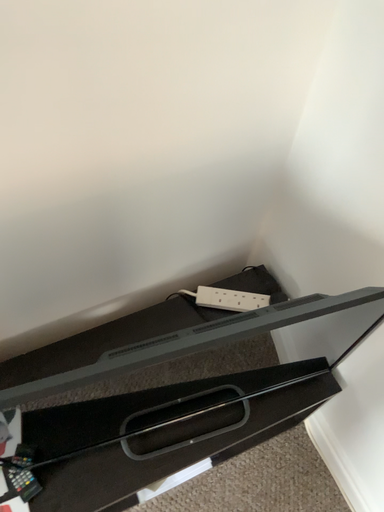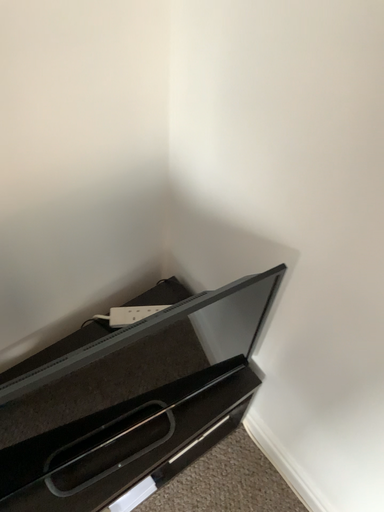
Question: How did the camera likely rotate when shooting the video?

Choices:
 (A) rotated right
 (B) rotated left

Answer: (A)